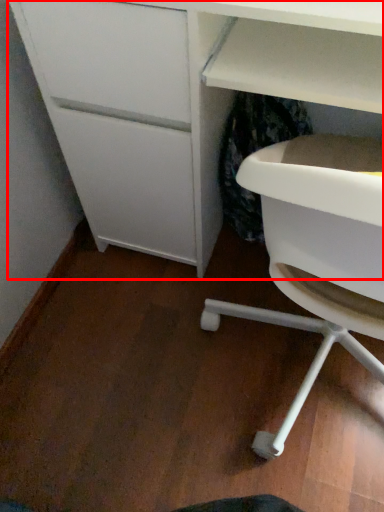
Question: Where is desk (annotated by the red box) located in relation to cabinetry in the image?

Choices:
 (A) right
 (B) left

Answer: (B)